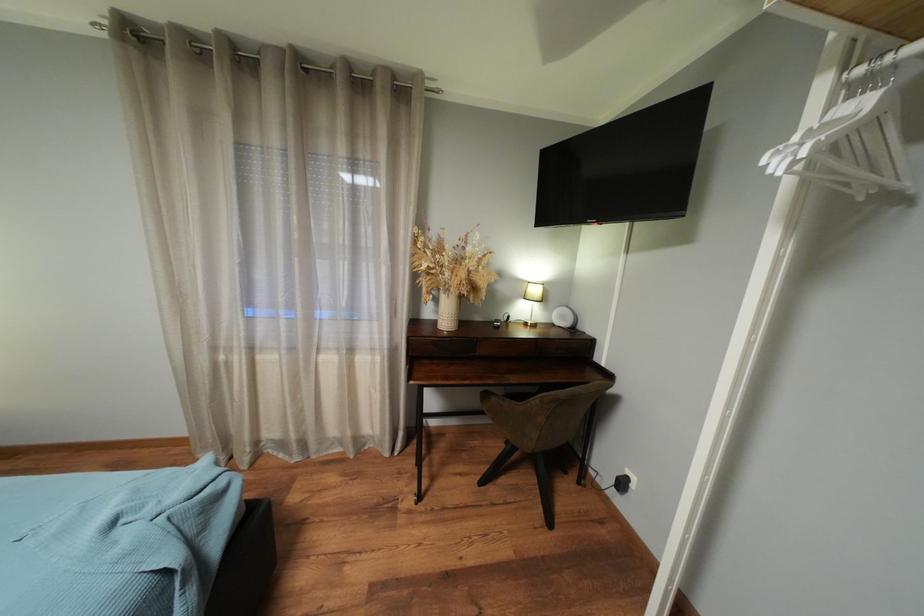
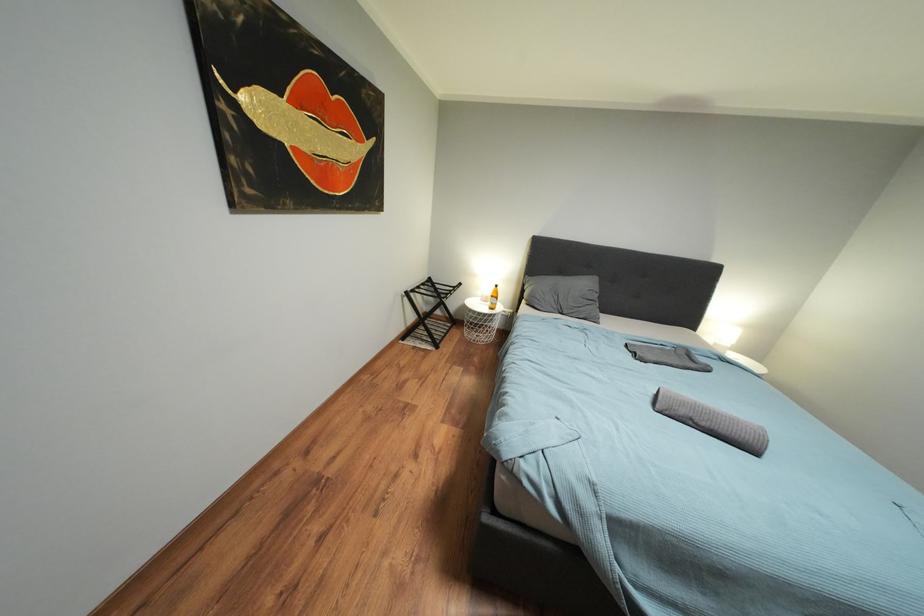
How did the camera likely rotate?

The camera rotated toward left-down.